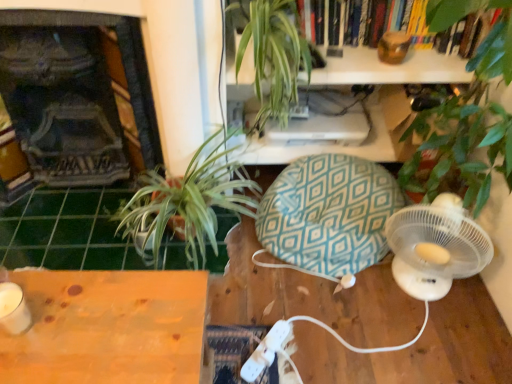
Question: Does wooden table at lower left have a larger size compared to green leafy plant at upper center?

Choices:
 (A) no
 (B) yes

Answer: (B)

Question: Are wooden table at lower left and green leafy plant at upper center far apart?

Choices:
 (A) yes
 (B) no

Answer: (B)

Question: From a real-world perspective, is wooden table at lower left beneath green leafy plant at upper center?

Choices:
 (A) no
 (B) yes

Answer: (B)

Question: Is wooden table at lower left looking in the opposite direction of green leafy plant at upper center?

Choices:
 (A) no
 (B) yes

Answer: (A)

Question: Is wooden table at lower left facing towards green leafy plant at upper center?

Choices:
 (A) no
 (B) yes

Answer: (A)

Question: In the image, is green tile at lower left positioned in front of or behind teal diamond-patterned bean bag chair at center?

Choices:
 (A) front
 (B) behind

Answer: (B)

Question: From the image's perspective, relative to teal diamond-patterned bean bag chair at center, is green tile at lower left above or below?

Choices:
 (A) below
 (B) above

Answer: (A)

Question: In terms of height, does green tile at lower left look taller or shorter compared to teal diamond-patterned bean bag chair at center?

Choices:
 (A) tall
 (B) short

Answer: (B)

Question: Is green tile at lower left spatially inside teal diamond-patterned bean bag chair at center, or outside of it?

Choices:
 (A) inside
 (B) outside

Answer: (B)

Question: In the image, is wooden table at lower left positioned in front of or behind white plastic wii controller at lower center?

Choices:
 (A) front
 (B) behind

Answer: (A)

Question: Considering the positions of wooden table at lower left and white plastic wii controller at lower center in the image, is wooden table at lower left taller or shorter than white plastic wii controller at lower center?

Choices:
 (A) short
 (B) tall

Answer: (B)

Question: Considering the relative positions of wooden table at lower left and white plastic wii controller at lower center in the image provided, is wooden table at lower left to the left or to the right of white plastic wii controller at lower center?

Choices:
 (A) left
 (B) right

Answer: (A)

Question: Is wooden table at lower left spatially inside white plastic wii controller at lower center, or outside of it?

Choices:
 (A) inside
 (B) outside

Answer: (B)

Question: Considering the positions of dark gray stone fireplace at left and green leafy plant at upper center in the image, is dark gray stone fireplace at left bigger or smaller than green leafy plant at upper center?

Choices:
 (A) small
 (B) big

Answer: (B)

Question: Which is correct: dark gray stone fireplace at left is inside green leafy plant at upper center, or outside of it?

Choices:
 (A) inside
 (B) outside

Answer: (B)